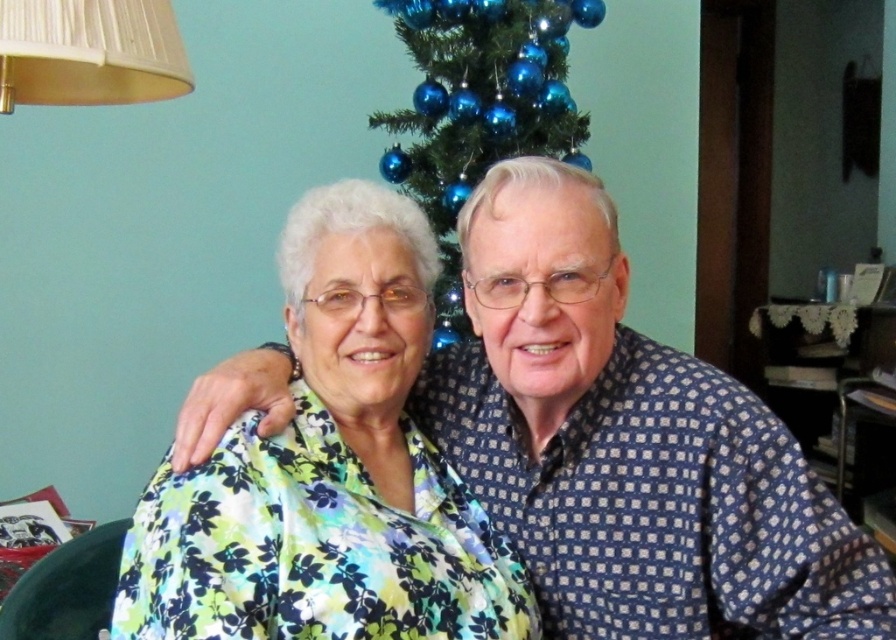
Is blue dotted shirt at center wider than floral fabric blouse at center?

Correct, the width of blue dotted shirt at center exceeds that of floral fabric blouse at center.

Is blue dotted shirt at center positioned in front of floral fabric blouse at center?

That is False.

I want to click on blue dotted shirt at center, so click(629, 448).

Consider the image. Is floral fabric blouse at center thinner than white pleated lampshade at upper left?

Incorrect, floral fabric blouse at center's width is not less than white pleated lampshade at upper left's.

Can you confirm if floral fabric blouse at center is positioned to the right of white pleated lampshade at upper left?

Yes, floral fabric blouse at center is to the right of white pleated lampshade at upper left.

Which is in front, point (369, 486) or point (145, 61)?

Positioned in front is point (369, 486).

Image resolution: width=896 pixels, height=640 pixels. What are the coordinates of `floral fabric blouse at center` in the screenshot? It's located at (329, 472).

Measure the distance from floral fabric blouse at center to blue glass ornaments at center.

floral fabric blouse at center and blue glass ornaments at center are 3.74 feet apart.

Which is more to the left, floral fabric blouse at center or blue glass ornaments at center?

Positioned to the left is floral fabric blouse at center.

What do you see at coordinates (329, 472) in the screenshot? Image resolution: width=896 pixels, height=640 pixels. I see `floral fabric blouse at center` at bounding box center [329, 472].

What are the coordinates of `floral fabric blouse at center` in the screenshot? It's located at (329, 472).